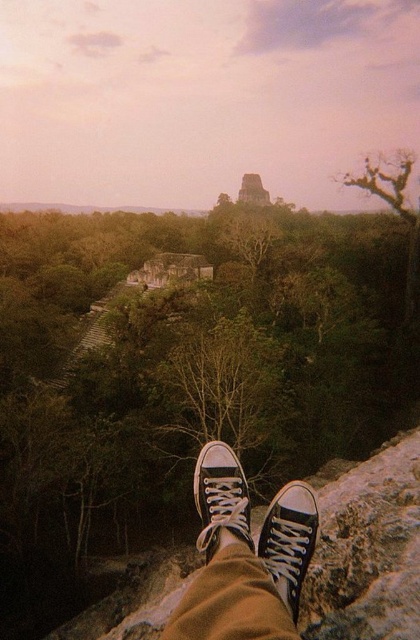
Question: Can you confirm if black canvas sneakers at lower center is bigger than black canvas shoe at lower center?

Choices:
 (A) yes
 (B) no

Answer: (B)

Question: In this image, where is black canvas shoe at center located relative to dark gray stone pyramid at center?

Choices:
 (A) right
 (B) left

Answer: (B)

Question: Which object appears farthest from the camera in this image?

Choices:
 (A) black canvas shoe at center
 (B) dark gray stone pyramid at center
 (C) black canvas sneakers at lower center

Answer: (B)

Question: Does black canvas sneakers at lower center have a larger size compared to dark gray stone pyramid at center?

Choices:
 (A) yes
 (B) no

Answer: (B)

Question: Which object is the farthest from the dark gray stone pyramid at center?

Choices:
 (A) black canvas sneakers at lower center
 (B) black canvas shoe at center
 (C) black canvas shoe at lower center

Answer: (A)

Question: Among these points, which one is nearest to the camera?

Choices:
 (A) (217, 493)
 (B) (246, 596)

Answer: (B)